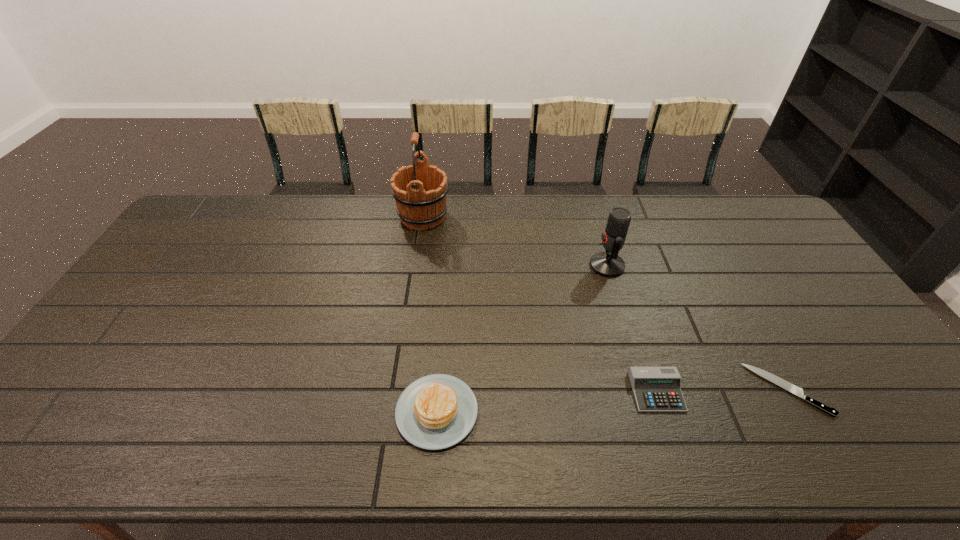
At what (x,y) coordinates should I click in order to perform the action: click on the tallest object. Please return your answer as a coordinate pair (x, y). The width and height of the screenshot is (960, 540). Looking at the image, I should click on (424, 207).

This screenshot has width=960, height=540. I want to click on wine bucket, so click(424, 207).

Where is `microphone`? microphone is located at coordinates tap(608, 264).

At what (x,y) coordinates should I click in order to perform the action: click on the second tallest object. Please return your answer as a coordinate pair (x, y). The image size is (960, 540). Looking at the image, I should click on (608, 264).

Where is `pancake`? The image size is (960, 540). pancake is located at coordinates (437, 411).

Where is `the second shortest object`? the second shortest object is located at coordinates (656, 389).

Find the location of a particular element. Image resolution: width=960 pixels, height=540 pixels. the rightmost object is located at coordinates (784, 384).

Image resolution: width=960 pixels, height=540 pixels. I want to click on steak knife, so [x=784, y=384].

At what (x,y) coordinates should I click in order to perform the action: click on vacant space located on the right of the farthest object. Please return your answer as a coordinate pair (x, y). Looking at the image, I should click on (502, 217).

The image size is (960, 540). I want to click on vacant region located 0.220m on the side of the microphone with the red ring, so click(x=521, y=266).